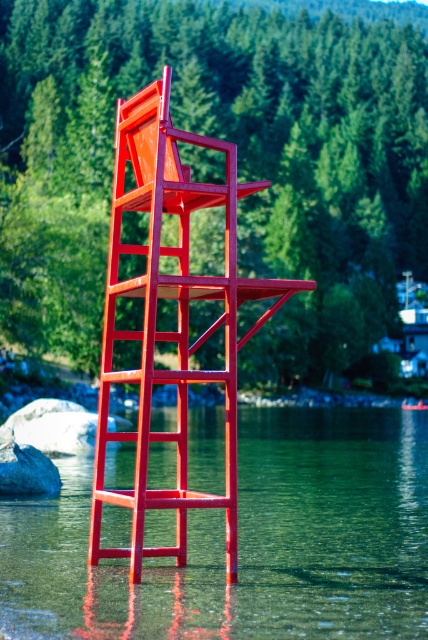
Question: Is metallic red ladder at center to the left of gray rock at center from the viewer's perspective?

Choices:
 (A) no
 (B) yes

Answer: (A)

Question: Among these objects, which one is farthest from the camera?

Choices:
 (A) gray rock at center
 (B) metallic red ladder at center

Answer: (A)

Question: Is clear glass water at center in front of gray rock at lower left?

Choices:
 (A) yes
 (B) no

Answer: (A)

Question: Among these points, which one is farthest from the camera?

Choices:
 (A) (253, 417)
 (B) (71, 429)

Answer: (A)

Question: Which is nearer to the gray rock at lower left?

Choices:
 (A) clear glass water at center
 (B) metallic red ladder at center
 (C) gray rock at center

Answer: (B)

Question: Can you confirm if clear glass water at center is positioned below gray rock at lower left?

Choices:
 (A) yes
 (B) no

Answer: (A)